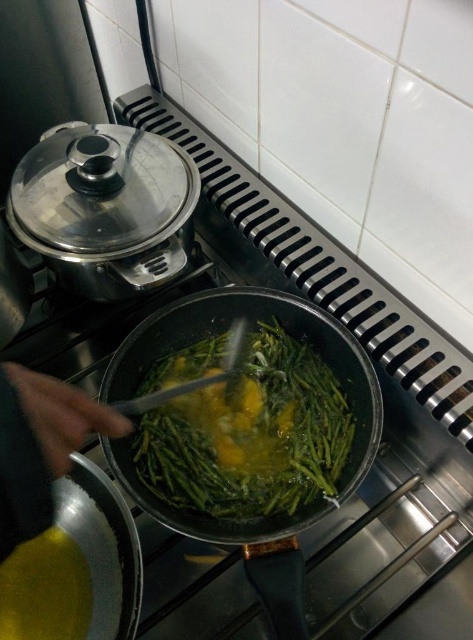
You are a chef standing in front of the black frying pan on the gas stove. You need to place two ingredients at specific points in the pan. The first ingredient must be placed at point (x=172, y=365) and the second at point (x=271, y=497). Which point is closer to you when you are looking directly at the pan?

Point (x=172, y=365) is closer to you because it is further to the viewer than point (x=271, y=497).